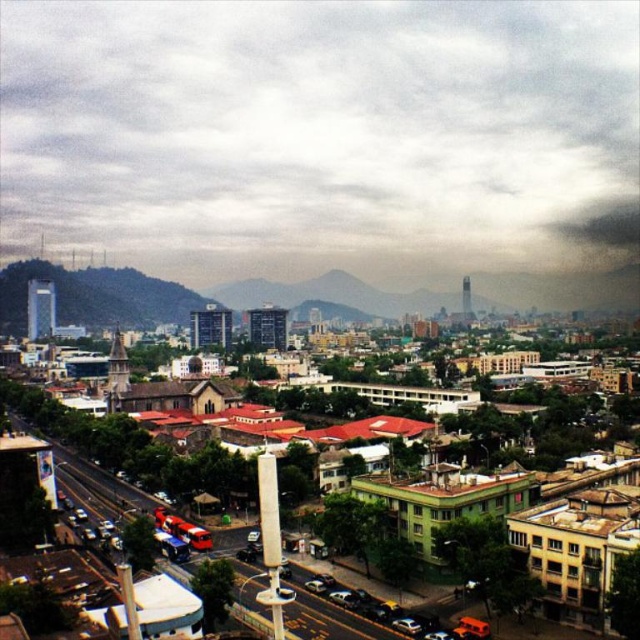
Question: Which is nearer to the brown textured building at lower left?

Choices:
 (A) cloudy sky at upper center
 (B) silver metallic car at lower center

Answer: (B)

Question: Considering the relative positions of cloudy sky at upper center and silver metallic car at lower center in the image provided, where is cloudy sky at upper center located with respect to silver metallic car at lower center?

Choices:
 (A) left
 (B) right

Answer: (A)

Question: From the image, what is the correct spatial relationship of cloudy sky at upper center in relation to silver metallic car at lower center?

Choices:
 (A) right
 (B) left

Answer: (B)

Question: Which point is farther to the camera?

Choices:
 (A) [x=76, y=77]
 (B) [x=400, y=625]

Answer: (A)

Question: Considering the real-world distances, which object is farthest from the silver metallic car at lower center?

Choices:
 (A) brown textured building at lower left
 (B) cloudy sky at upper center

Answer: (B)

Question: Can you confirm if cloudy sky at upper center is thinner than silver metallic car at lower center?

Choices:
 (A) yes
 (B) no

Answer: (B)